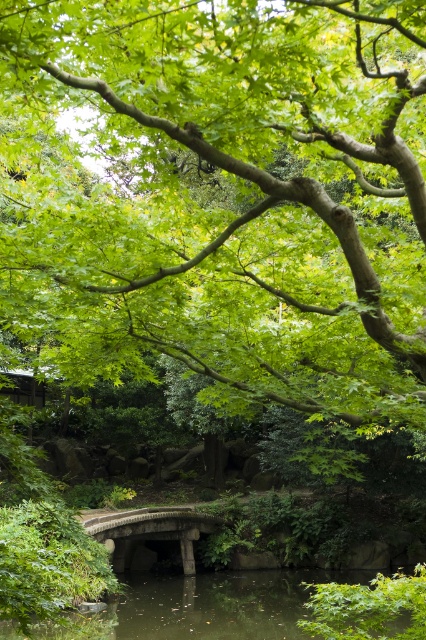
Can you confirm if green liquid water at center is shorter than stone bridge at center?

No, green liquid water at center is not shorter than stone bridge at center.

Does green liquid water at center appear on the left side of stone bridge at center?

No, green liquid water at center is not to the left of stone bridge at center.

Identify the location of green liquid water at center. The width and height of the screenshot is (426, 640). (199, 609).

Identify the location of green liquid water at center. This screenshot has height=640, width=426. (199, 609).